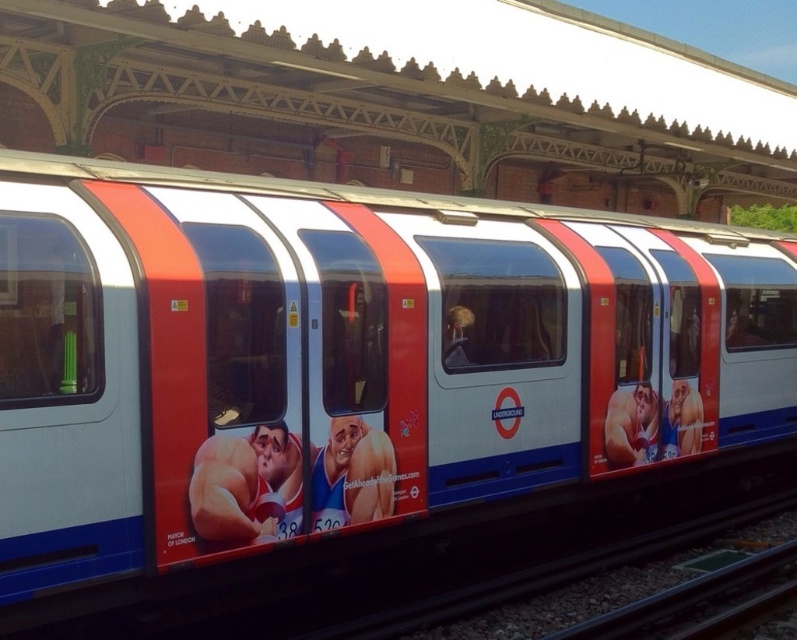
You are standing at the station platform looking at the train. There are two points marked on the train, one at coordinate point (363, 476) and the other at point (644, 612). Which point is closer to you?

Point (363, 476) is closer to the viewer than point (644, 612).